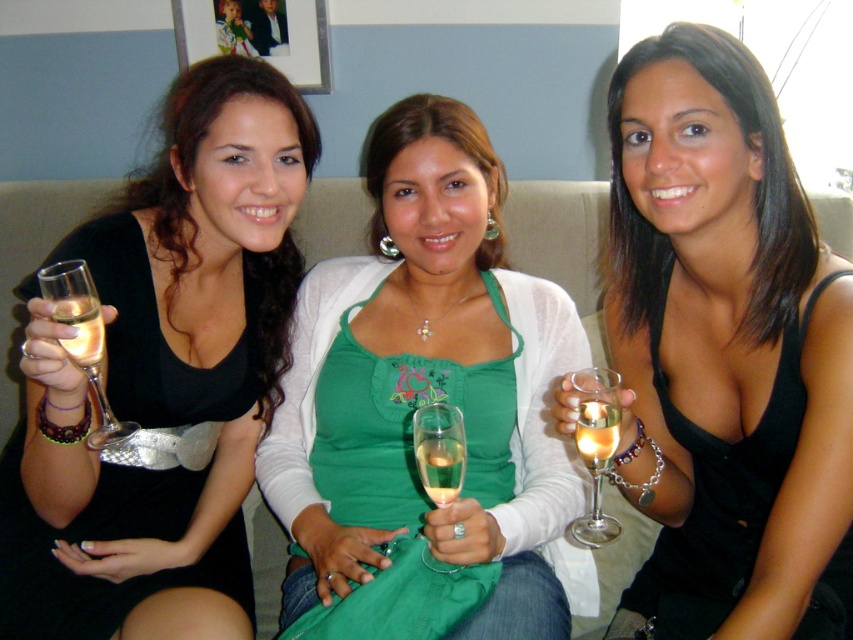
Is translucent glass flute at center smaller than clear glass wine at left?

Incorrect, translucent glass flute at center is not smaller in size than clear glass wine at left.

Which is more to the right, translucent glass flute at center or clear glass wine at left?

translucent glass flute at center

Is point (428, 458) closer to camera compared to point (88, 356)?

Yes, point (428, 458) is closer to viewer.

What are the coordinates of `translucent glass flute at center` in the screenshot? It's located at (439, 451).

Does point (93, 305) lie behind point (595, 369)?

Yes, point (93, 305) is farther from viewer.

Can you confirm if clear glass wine glass at left is smaller than translucent glass wine glass at center?

Incorrect, clear glass wine glass at left is not smaller in size than translucent glass wine glass at center.

Locate an element on the screen. Image resolution: width=853 pixels, height=640 pixels. clear glass wine glass at left is located at coordinates (83, 339).

Who is higher up, green matte tank top at center or clear glass wine glass at left?

Positioned higher is green matte tank top at center.

Which is more to the left, green matte tank top at center or clear glass wine glass at left?

Positioned to the left is clear glass wine glass at left.

Locate an element on the screen. This screenshot has width=853, height=640. green matte tank top at center is located at coordinates (421, 138).

Locate an element on the screen. This screenshot has width=853, height=640. green matte tank top at center is located at coordinates [421, 138].